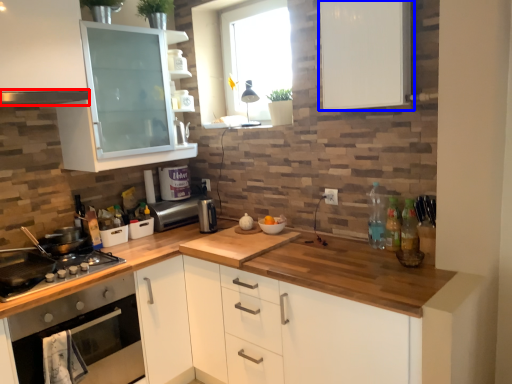
Question: Which object appears farthest to the camera in this image, exhaust hood (highlighted by a red box) or cabinetry (highlighted by a blue box)?

Choices:
 (A) exhaust hood
 (B) cabinetry

Answer: (A)